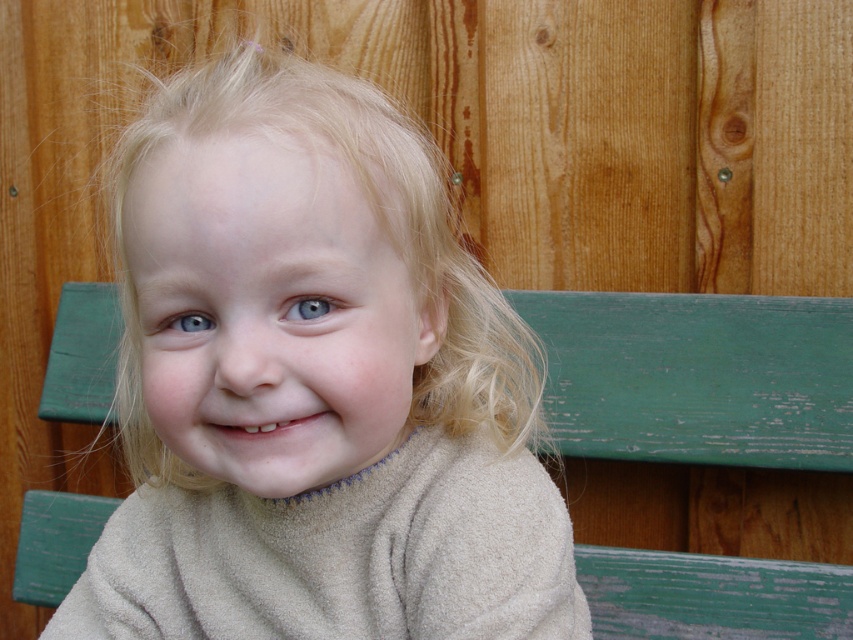
You are a photographer setting up a shot of the child sitting on the bench. You want to ensure the beige fleece at center and the green painted wood bench at center are both visible in the frame. Based on their positions, which object should you position closer to the left side of the camera frame?

The beige fleece at center should be positioned closer to the left side of the camera frame since it is already located to the left of the green painted wood bench at center in the image.